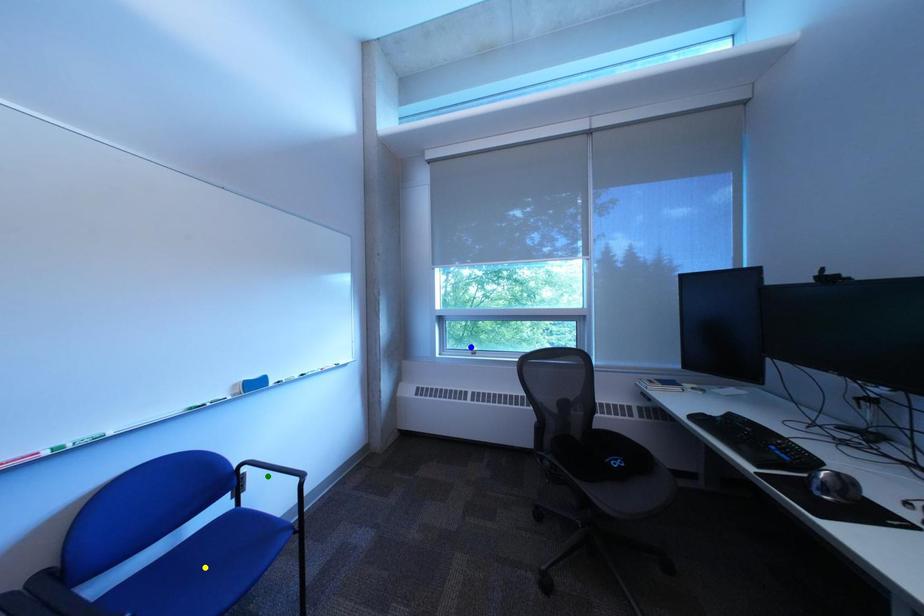
In the scene shown: Order these from nearest to farthest:
blue point | yellow point | green point

blue point, green point, yellow point